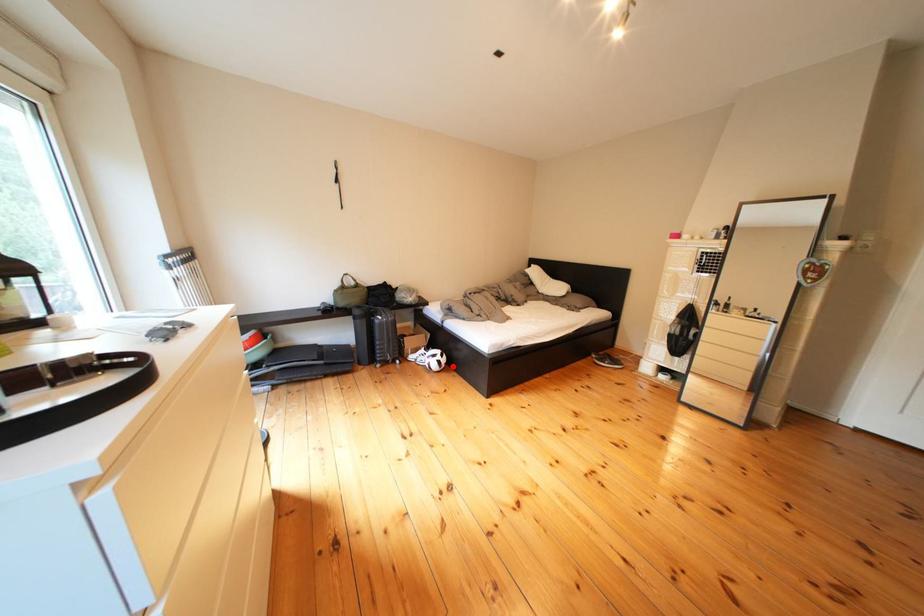
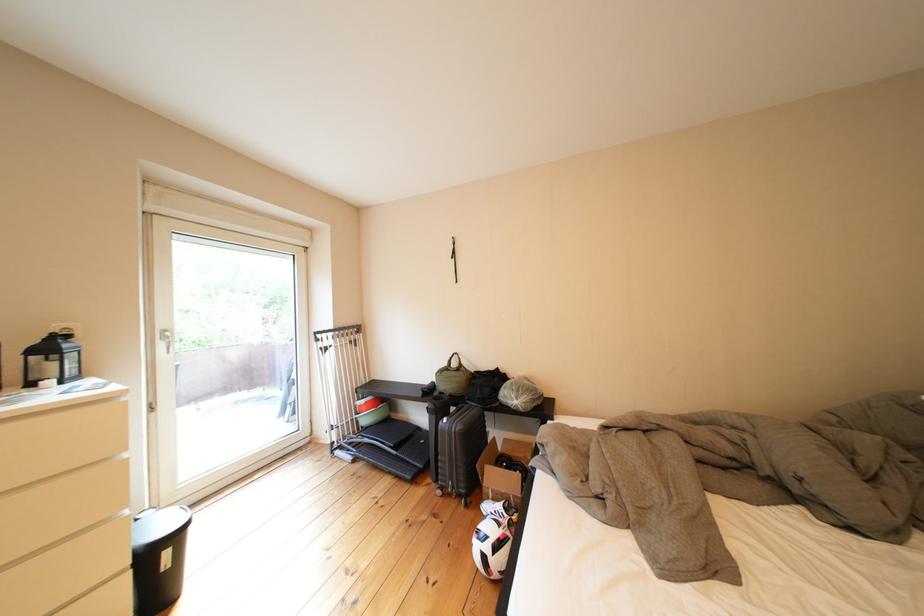
Find the pixel in the second image that matches the highlighted location in the first image.

(499, 562)